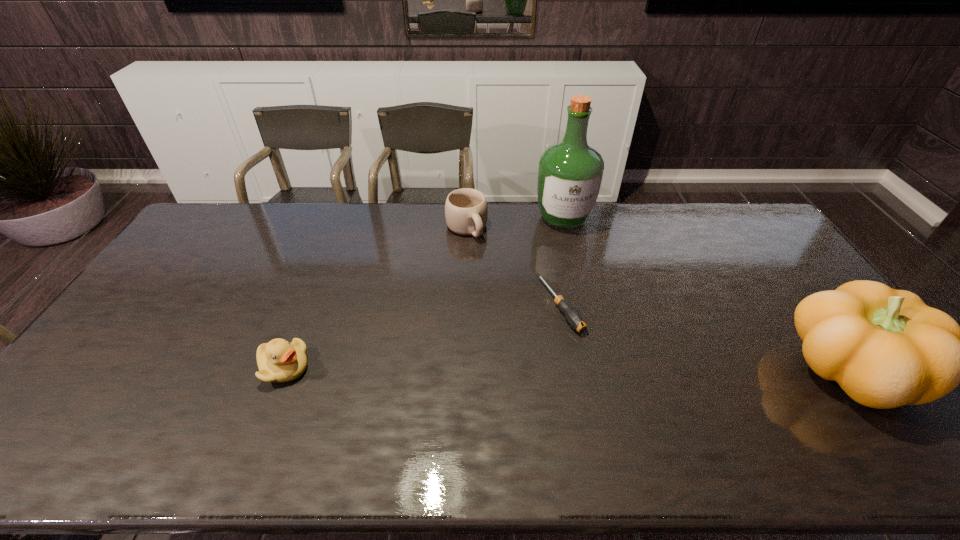
The height and width of the screenshot is (540, 960). I want to click on free spot that satisfies the following two spatial constraints: 1. on the back side of the shortest object; 2. on the left side of the tallest object, so click(544, 218).

The height and width of the screenshot is (540, 960). What are the coordinates of `free space that satisfies the following two spatial constraints: 1. on the front side of the second object from left to right; 2. on the left side of the screwdriver` in the screenshot? It's located at (464, 305).